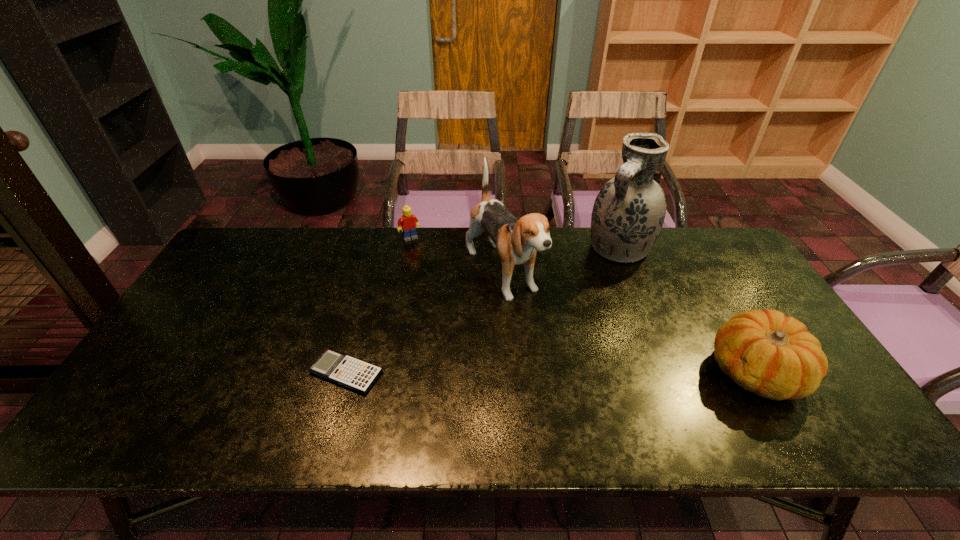
What are the coordinates of `vacant space that satisfies the following two spatial constraints: 1. on the back side of the fourth shortest object; 2. on the left side of the shortest object` in the screenshot? It's located at (373, 275).

Find the location of a particular element. The image size is (960, 540). free location that satisfies the following two spatial constraints: 1. on the back side of the calculator; 2. on the right side of the Lego is located at coordinates (384, 238).

The height and width of the screenshot is (540, 960). I want to click on free point that satisfies the following two spatial constraints: 1. on the front side of the puppy; 2. on the right side of the Lego, so click(x=403, y=275).